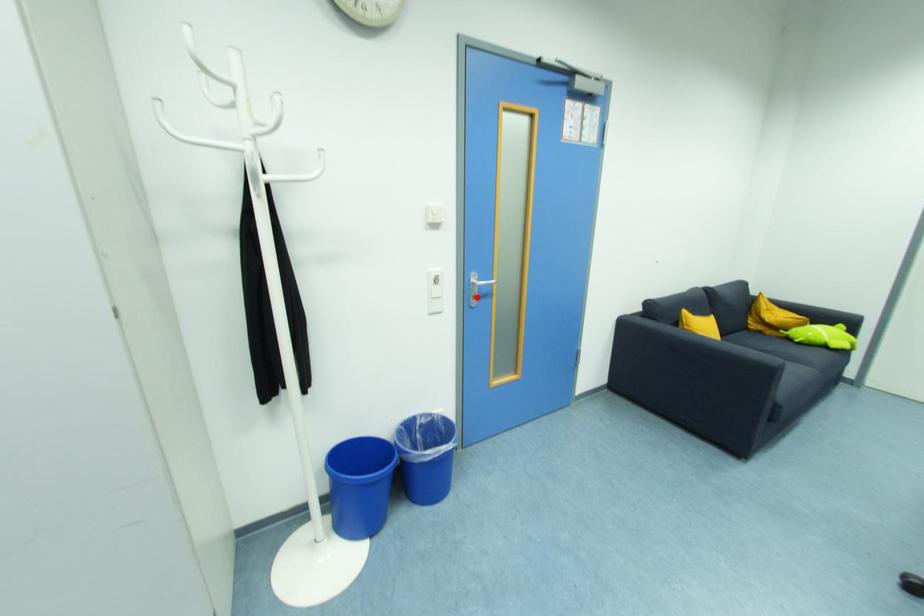
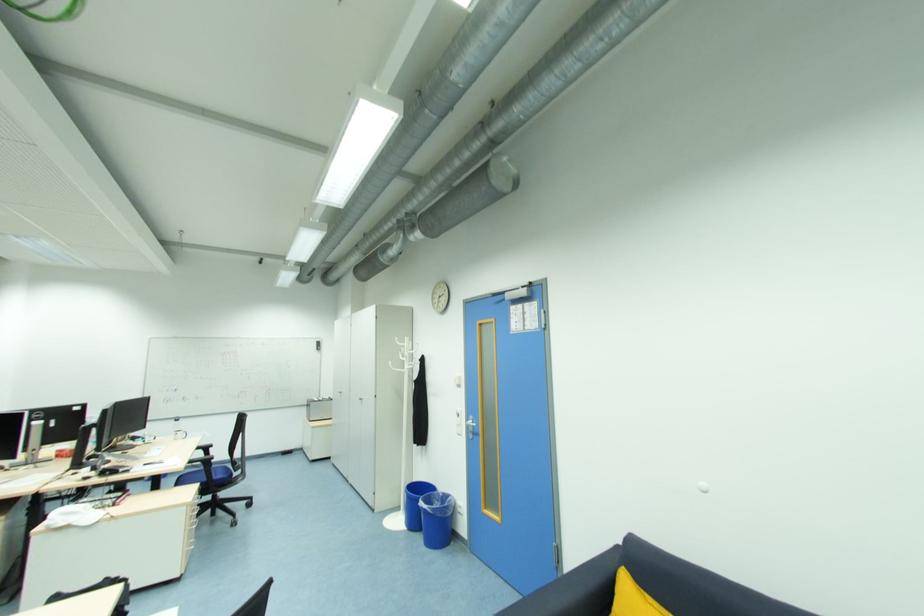
Locate, in the second image, the point that corresponds to the highlighted location in the first image.

(473, 432)